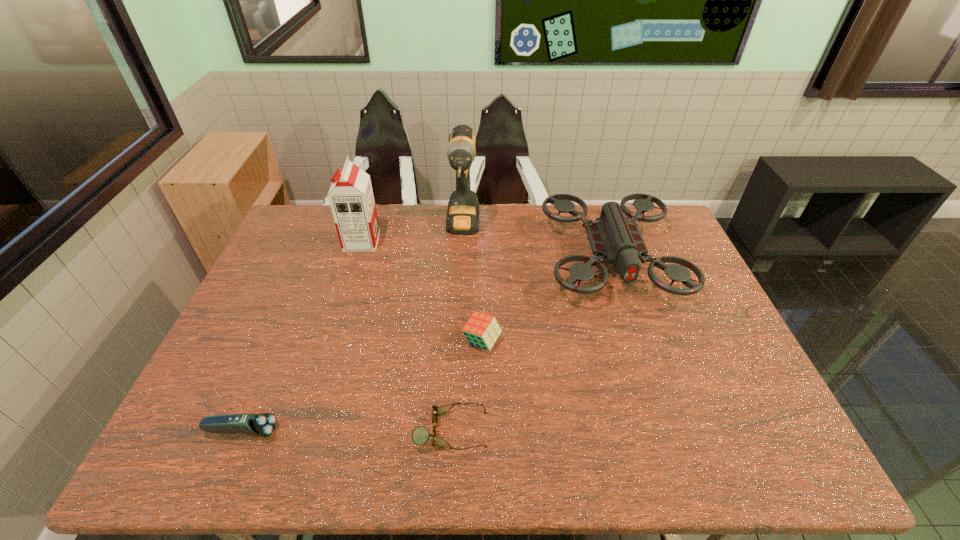
Where is `vacant space located 0.110m on the front-facing side of the fourth shortest object`? The height and width of the screenshot is (540, 960). vacant space located 0.110m on the front-facing side of the fourth shortest object is located at coordinates (639, 345).

The height and width of the screenshot is (540, 960). Find the location of `vacant region located 0.260m on the front of the third shortest object`. vacant region located 0.260m on the front of the third shortest object is located at coordinates (482, 452).

Locate an element on the screen. This screenshot has width=960, height=540. vacant space located on the head of the electric shaver is located at coordinates (370, 431).

Locate an element on the screen. This screenshot has height=540, width=960. vacant space situated 0.370m on the front-facing side of the shortest object is located at coordinates (650, 430).

At what (x,y) coordinates should I click in order to perform the action: click on drill present at the far edge. Please return your answer as a coordinate pair (x, y). This screenshot has width=960, height=540. Looking at the image, I should click on (462, 218).

The height and width of the screenshot is (540, 960). Identify the location of soya milk present at the far edge. pyautogui.click(x=351, y=199).

At what (x,y) coordinates should I click in order to perform the action: click on drone situated at the far edge. Please return your answer as a coordinate pair (x, y). This screenshot has width=960, height=540. Looking at the image, I should click on (611, 238).

In order to click on electric shaver positioned at the near edge in this screenshot , I will do pos(264,424).

Locate an element on the screen. This screenshot has height=540, width=960. spectacles that is at the near edge is located at coordinates (420, 435).

Locate an element on the screen. object that is positioned at the left edge is located at coordinates (264, 424).